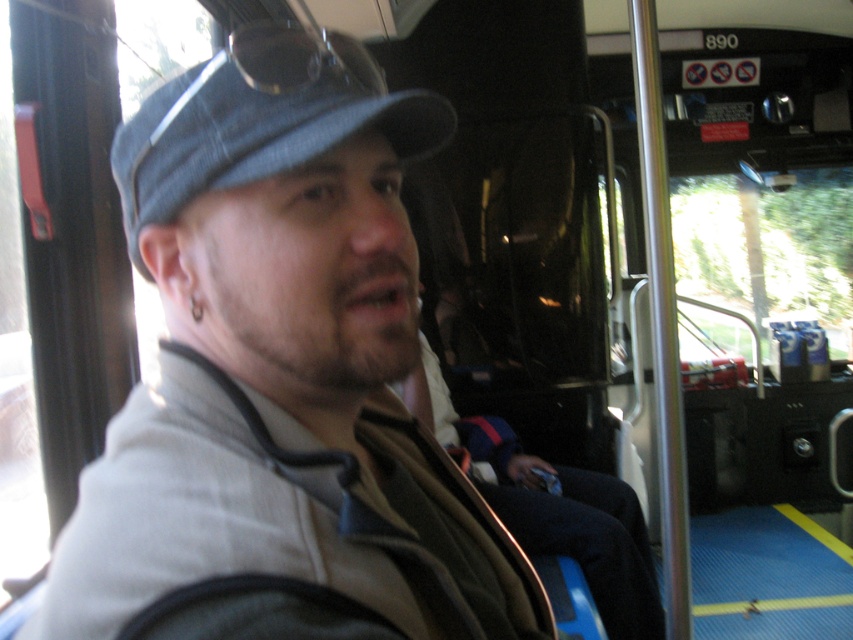
Question: From the image, what is the correct spatial relationship of denim baseball cap at center in relation to dark blue fabric jacket at center?

Choices:
 (A) left
 (B) right

Answer: (A)

Question: Does denim baseball cap at center appear over dark blue fabric jacket at center?

Choices:
 (A) yes
 (B) no

Answer: (A)

Question: Is denim baseball cap at center below dark blue fabric jacket at center?

Choices:
 (A) no
 (B) yes

Answer: (A)